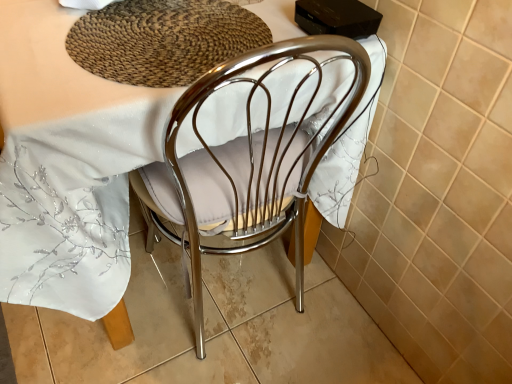
Question: Should I look upward or downward to see woven brown mat at upper center?

Choices:
 (A) down
 (B) up

Answer: (B)

Question: Considering the relative sizes of polished chrome chair at center and woven brown mat at upper center in the image provided, is polished chrome chair at center smaller than woven brown mat at upper center?

Choices:
 (A) no
 (B) yes

Answer: (A)

Question: Is polished chrome chair at center behind woven brown mat at upper center?

Choices:
 (A) no
 (B) yes

Answer: (A)

Question: From a real-world perspective, is polished chrome chair at center positioned over woven brown mat at upper center based on gravity?

Choices:
 (A) no
 (B) yes

Answer: (A)

Question: Is polished chrome chair at center wider than woven brown mat at upper center?

Choices:
 (A) yes
 (B) no

Answer: (A)

Question: Is polished chrome chair at center completely or partially outside of woven brown mat at upper center?

Choices:
 (A) no
 (B) yes

Answer: (B)

Question: Does polished chrome chair at center have a lesser height compared to woven brown mat at upper center?

Choices:
 (A) no
 (B) yes

Answer: (A)

Question: Is woven brown mat at upper center wider than polished chrome chair at center?

Choices:
 (A) no
 (B) yes

Answer: (A)

Question: Could you tell me if woven brown mat at upper center is facing polished chrome chair at center?

Choices:
 (A) no
 (B) yes

Answer: (B)

Question: Can you confirm if woven brown mat at upper center is positioned to the left of polished chrome chair at center?

Choices:
 (A) yes
 (B) no

Answer: (B)

Question: Can you confirm if woven brown mat at upper center is bigger than polished chrome chair at center?

Choices:
 (A) yes
 (B) no

Answer: (B)

Question: From a real-world perspective, is woven brown mat at upper center on polished chrome chair at center?

Choices:
 (A) no
 (B) yes

Answer: (B)

Question: Considering the relative sizes of woven brown mat at upper center and polished chrome chair at center in the image provided, is woven brown mat at upper center smaller than polished chrome chair at center?

Choices:
 (A) no
 (B) yes

Answer: (B)

Question: From the image's perspective, relative to woven brown mat at upper center, is polished chrome chair at center above or below?

Choices:
 (A) above
 (B) below

Answer: (B)